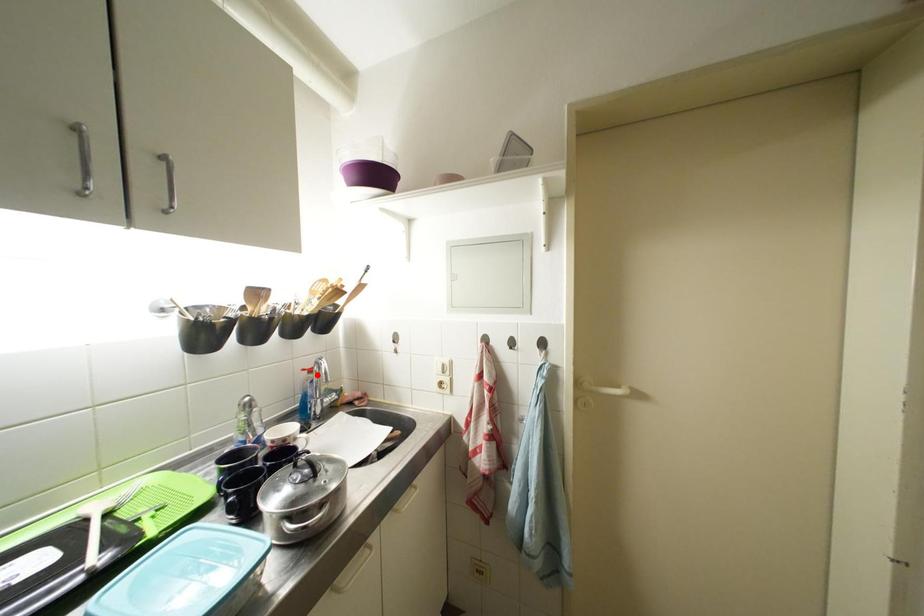
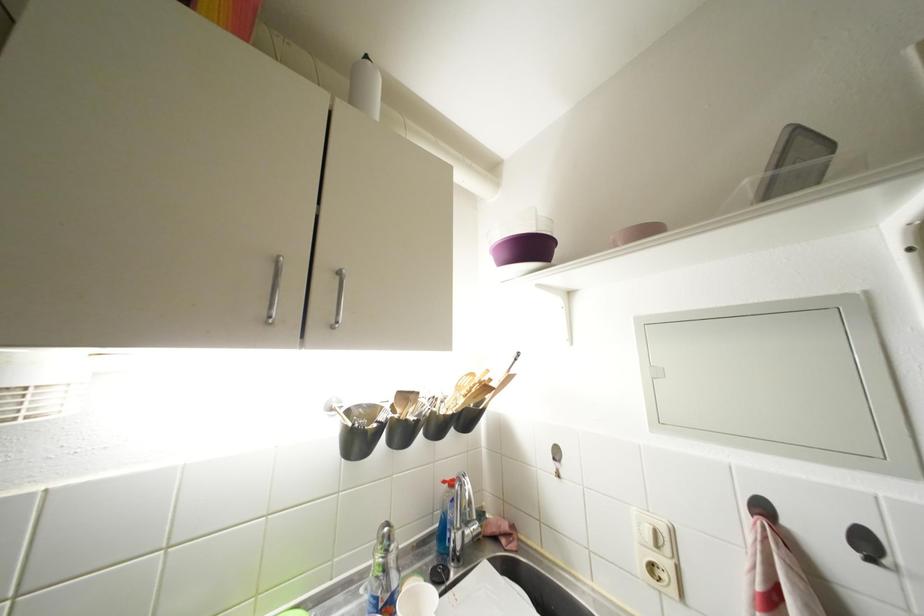
The point at the highlighted location is marked in the first image. Where is the corresponding point in the second image?

(457, 488)